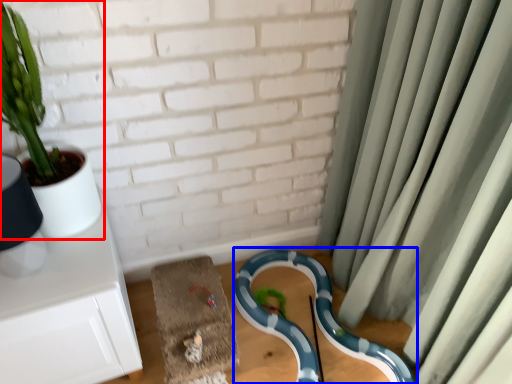
Question: Which of the following is the farthest to the observer, houseplant (highlighted by a red box) or snake (highlighted by a blue box)?

Choices:
 (A) houseplant
 (B) snake

Answer: (B)